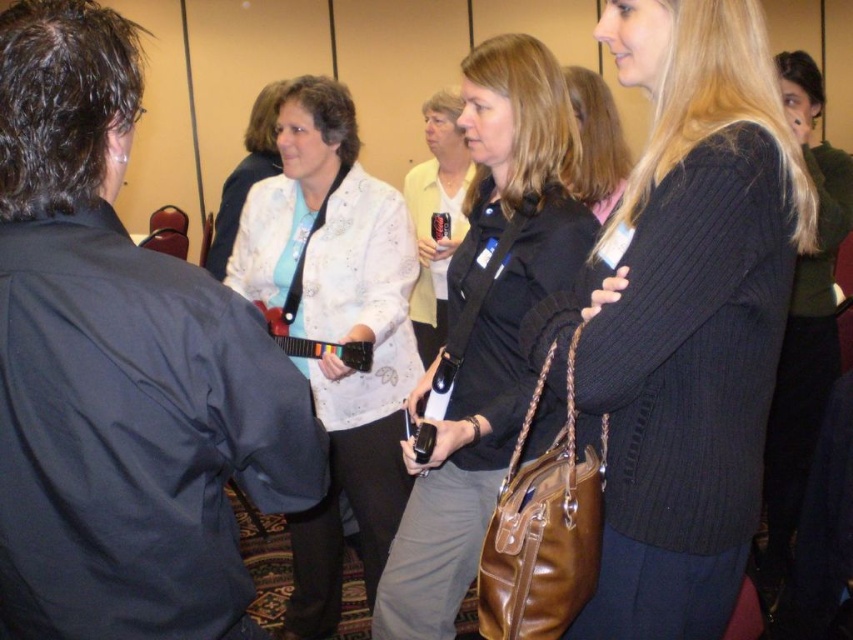
Question: Which object is positioned closest to the white textured blouse at center?

Choices:
 (A) blonde hair at center
 (B) black ribbed sweater at center

Answer: (A)

Question: Which of the following is the closest to the observer?

Choices:
 (A) blonde hair at center
 (B) white textured blouse at center
 (C) matte black jacket at center
 (D) black ribbed sweater at center

Answer: (D)

Question: Is white textured blouse at center bigger than blonde hair at center?

Choices:
 (A) no
 (B) yes

Answer: (B)

Question: Does black ribbed sweater at center have a lesser width compared to matte black jacket at center?

Choices:
 (A) no
 (B) yes

Answer: (B)

Question: Which of the following is the closest to the observer?

Choices:
 (A) blonde hair at center
 (B) black ribbed sweater at center

Answer: (B)

Question: Does matte black jacket at center have a lesser width compared to white textured blouse at center?

Choices:
 (A) no
 (B) yes

Answer: (B)